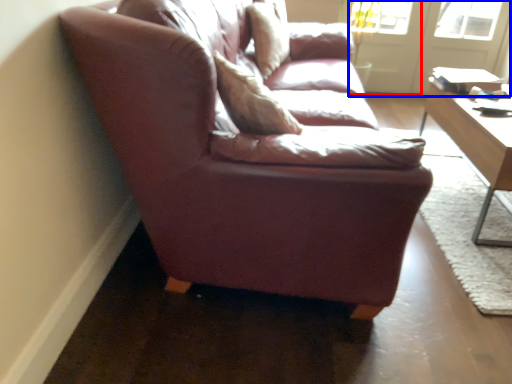
Question: Which object is closer to the camera taking this photo, screen door (highlighted by a red box) or screen door (highlighted by a blue box)?

Choices:
 (A) screen door
 (B) screen door

Answer: (B)